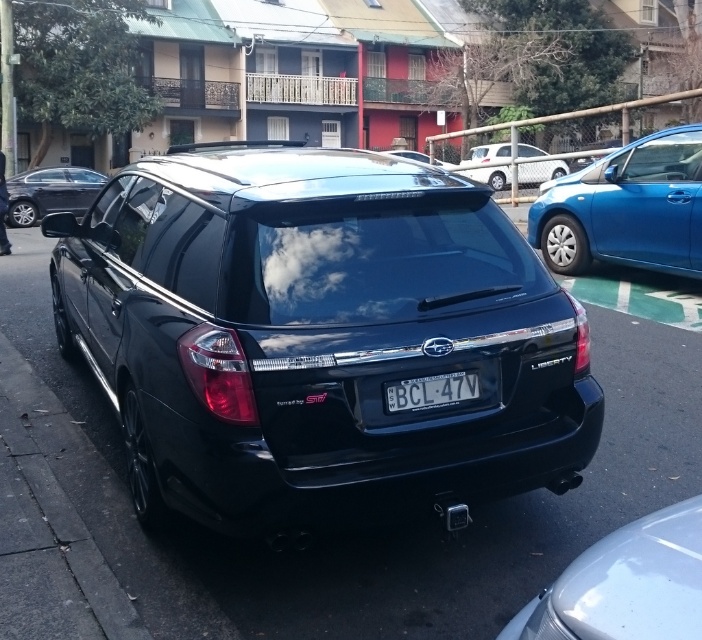
Question: Which object is the farthest from the glossy black car at center?

Choices:
 (A) white glossy bumper at lower right
 (B) white matte sedan at center

Answer: (A)

Question: Is matte black car at center to the left of white glossy bumper at lower right from the viewer's perspective?

Choices:
 (A) no
 (B) yes

Answer: (B)

Question: Is matte black car at left positioned at the back of white matte sedan at center?

Choices:
 (A) yes
 (B) no

Answer: (B)

Question: Which point appears farthest from the camera in this image?

Choices:
 (A) (689, 216)
 (B) (131, 429)

Answer: (A)

Question: Which object appears farthest from the camera in this image?

Choices:
 (A) matte black car at left
 (B) glossy black car at center
 (C) white glossy bumper at lower right

Answer: (A)

Question: Can you confirm if white plastic license plate at center is positioned above glossy black car at center?

Choices:
 (A) yes
 (B) no

Answer: (B)